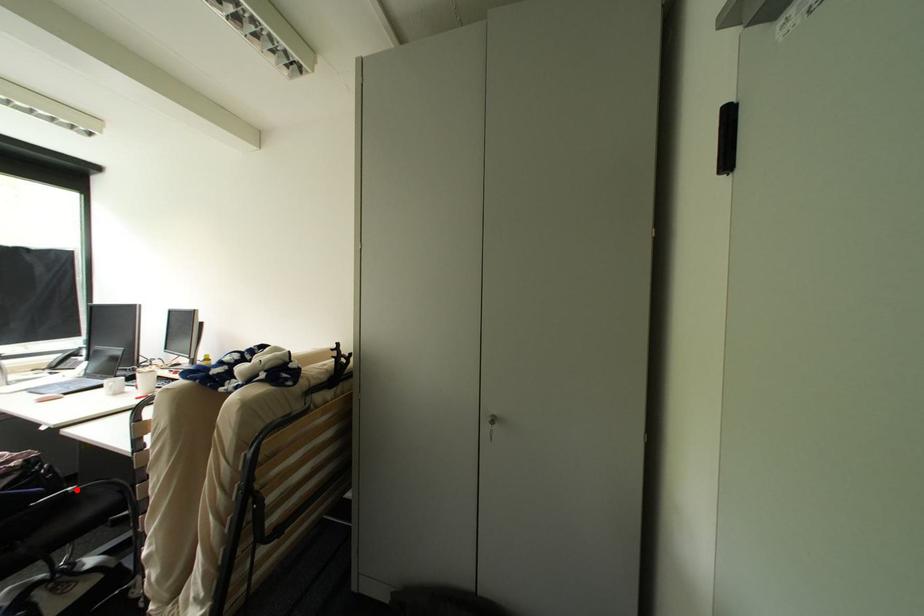
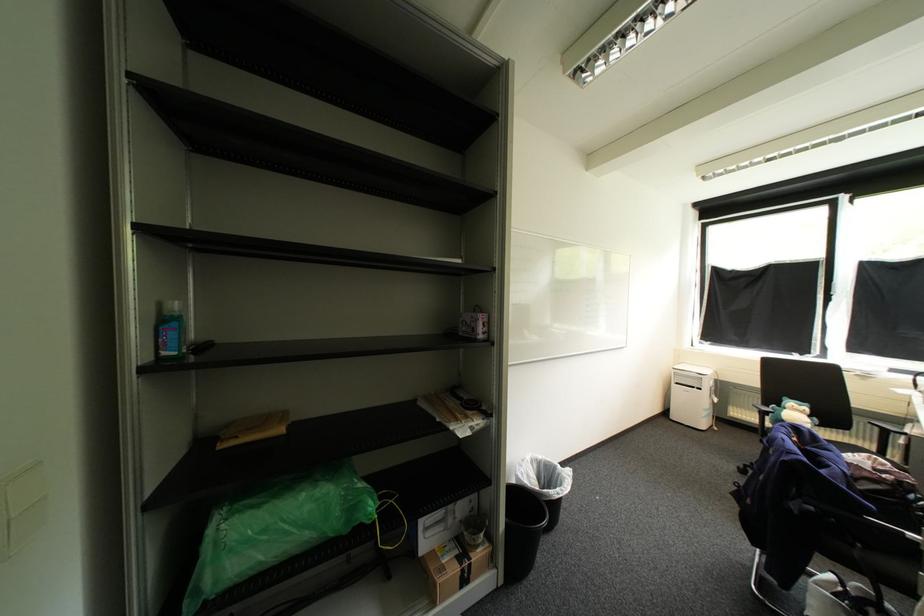
Question: I am providing you with two images of the same scene from different viewpoints. Image1 has a red point marked. In image2, the corresponding 3D location appears at what relative position? Reply with the corresponding letter.

Choices:
 (A) Closer
 (B) Farther

Answer: (B)